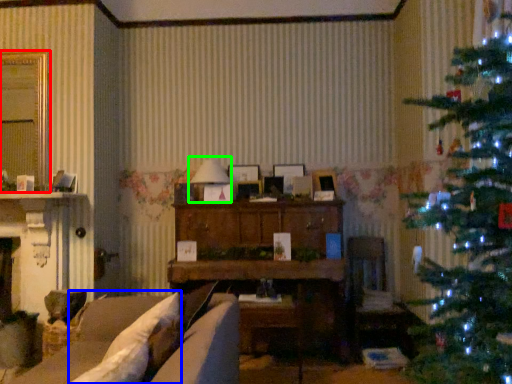
Question: Estimate the real-world distances between objects in this image. Which object is farther from window (highlighted by a red box), pillow (highlighted by a blue box) or lamp (highlighted by a green box)?

Choices:
 (A) pillow
 (B) lamp

Answer: (A)